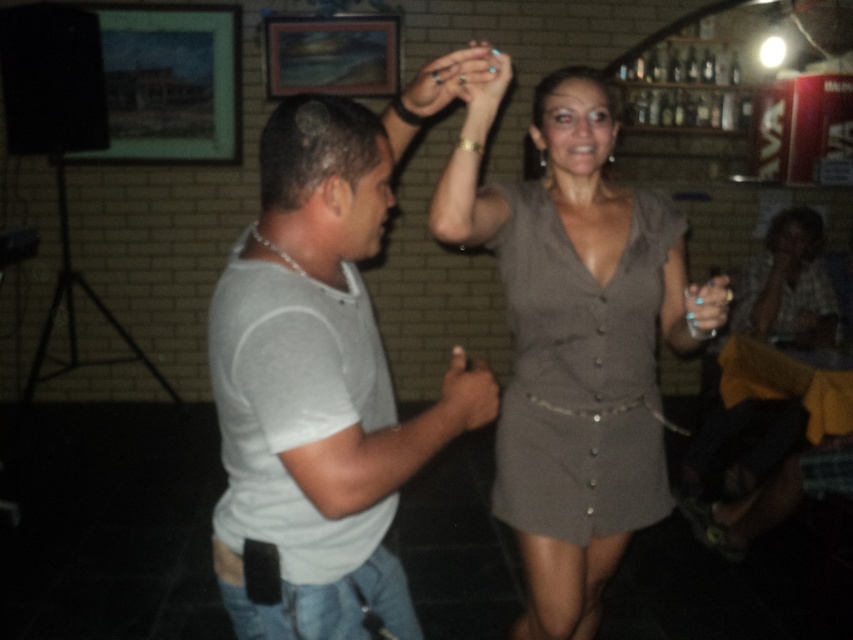
Does white matte t-shirt at center have a smaller size compared to matte silver ring at upper center?

Incorrect, white matte t-shirt at center is not smaller in size than matte silver ring at upper center.

From the picture: Does white matte t-shirt at center appear over matte silver ring at upper center?

No, white matte t-shirt at center is not above matte silver ring at upper center.

Between point (341, 252) and point (473, 64), which one is positioned behind?

Positioned behind is point (473, 64).

The image size is (853, 640). I want to click on white matte t-shirt at center, so click(315, 378).

Does gray matte dress at center appear over matte gray hand at center?

Yes.

Does gray matte dress at center have a lesser height compared to matte gray hand at center?

Incorrect, gray matte dress at center's height does not fall short of matte gray hand at center's.

The width and height of the screenshot is (853, 640). Find the location of `gray matte dress at center`. gray matte dress at center is located at coordinates (579, 376).

Find the location of a particular element. gray matte dress at center is located at coordinates (579, 376).

Can you confirm if matte gray dress at center is positioned to the left of matte silver ring at upper center?

Incorrect, matte gray dress at center is not on the left side of matte silver ring at upper center.

Where is `matte gray dress at center`? matte gray dress at center is located at coordinates (579, 230).